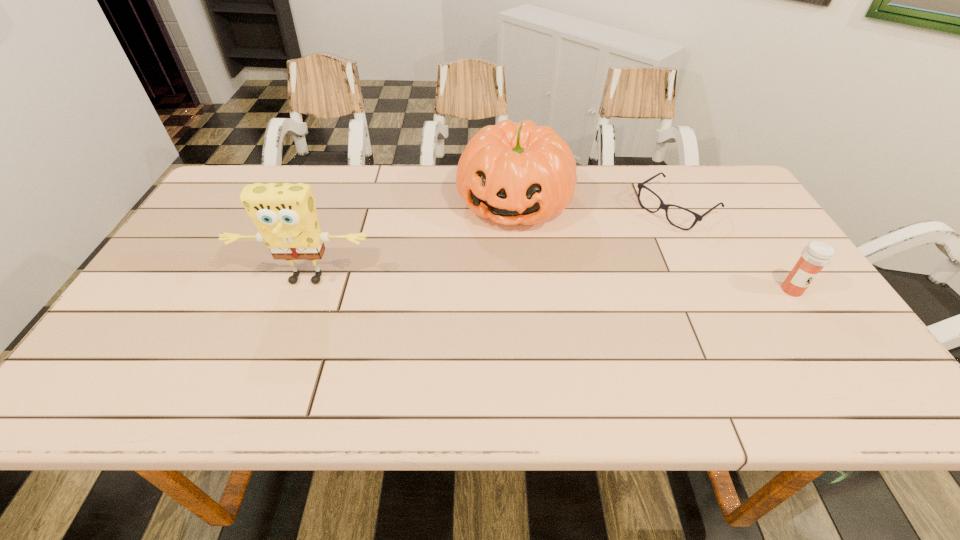
You are a GUI agent. You are given a task and a screenshot of the screen. Output one action in this format:
    pyautogui.click(x=<x>, y=<y>)
    Task: Click on the leftmost object
    
    Given the screenshot: What is the action you would take?
    pyautogui.click(x=285, y=215)

At what (x,y) coordinates should I click in order to perform the action: click on medicine. Please return your answer as a coordinate pair (x, y). Looking at the image, I should click on (817, 254).

This screenshot has height=540, width=960. I want to click on the rightmost object, so click(x=817, y=254).

In order to click on spectacles in this screenshot , I will do `click(663, 206)`.

Identify the location of the second object from right to left. (663, 206).

Find the location of a particular element. Image resolution: width=960 pixels, height=540 pixels. pumpkin is located at coordinates (512, 173).

Find the location of a particular element. This screenshot has height=540, width=960. free point located on the face of the leftmost object is located at coordinates (278, 354).

Identify the location of vacant space located 0.100m on the label side of the medicine. The height and width of the screenshot is (540, 960). (820, 332).

The height and width of the screenshot is (540, 960). What are the coordinates of `vacant space located 0.220m on the front-facing side of the shortest object` in the screenshot? It's located at (602, 259).

The image size is (960, 540). In order to click on vacant area situated on the front-facing side of the shortest object in this screenshot , I will do `click(604, 258)`.